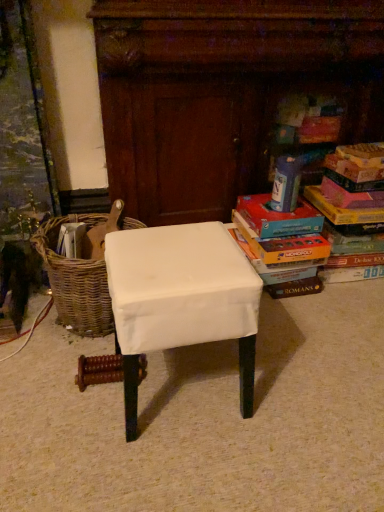
Question: Is multicolored cardboard books at right, the 1th book viewed from the right, further to the viewer compared to woven brown basket at left?

Choices:
 (A) no
 (B) yes

Answer: (B)

Question: Is multicolored cardboard books at right, which ranks as the 2th book in left-to-right order, shorter than woven brown basket at left?

Choices:
 (A) yes
 (B) no

Answer: (B)

Question: Would you say multicolored cardboard books at right, which ranks as the 2th book in left-to-right order, is outside woven brown basket at left?

Choices:
 (A) no
 (B) yes

Answer: (B)

Question: Is multicolored cardboard books at right, the 1th book viewed from the right, closer to camera compared to woven brown basket at left?

Choices:
 (A) no
 (B) yes

Answer: (A)

Question: Is woven brown basket at left located within multicolored cardboard books at right, which ranks as the 2th book in left-to-right order?

Choices:
 (A) yes
 (B) no

Answer: (B)

Question: Can you confirm if multicolored cardboard books at right, the 1th book viewed from the right, is positioned to the right of woven brown basket at left?

Choices:
 (A) no
 (B) yes

Answer: (B)

Question: From a real-world perspective, is white fabric-covered stool at center located higher than hardcover book at upper right?

Choices:
 (A) yes
 (B) no

Answer: (B)

Question: Can you confirm if white fabric-covered stool at center is wider than hardcover book at upper right?

Choices:
 (A) yes
 (B) no

Answer: (A)

Question: Can you confirm if white fabric-covered stool at center is smaller than hardcover book at upper right?

Choices:
 (A) no
 (B) yes

Answer: (A)

Question: Does white fabric-covered stool at center have a greater height compared to hardcover book at upper right?

Choices:
 (A) no
 (B) yes

Answer: (B)

Question: Considering the relative positions of white fabric-covered stool at center and hardcover book at upper right in the image provided, is white fabric-covered stool at center to the right of hardcover book at upper right from the viewer's perspective?

Choices:
 (A) no
 (B) yes

Answer: (A)

Question: Could you tell me if white fabric-covered stool at center is facing hardcover book at upper right?

Choices:
 (A) yes
 (B) no

Answer: (B)

Question: Would you say matte cardboard book at right, which ranks as the second book in right-to-left order, contains multicolored cardboard books at right, the 1th book viewed from the right?

Choices:
 (A) yes
 (B) no

Answer: (B)